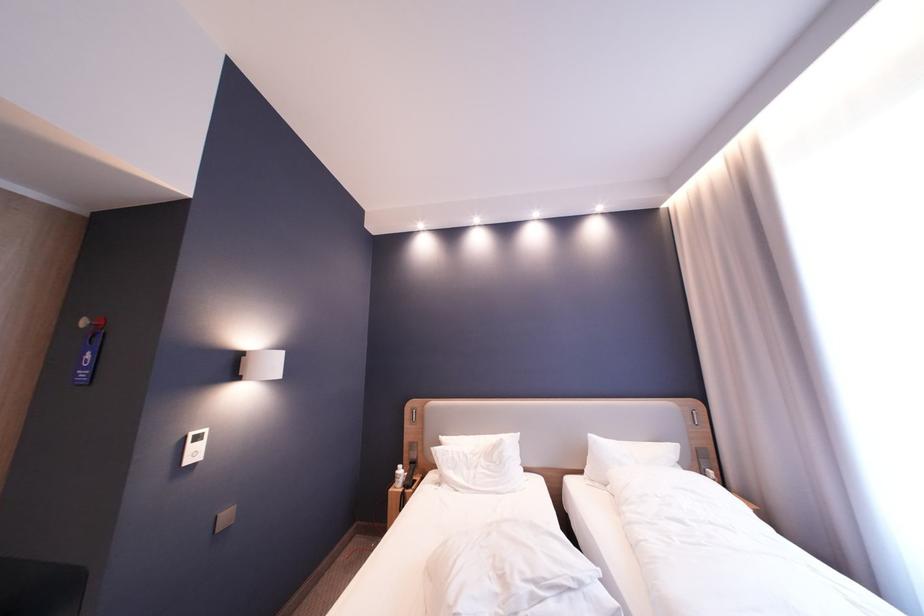
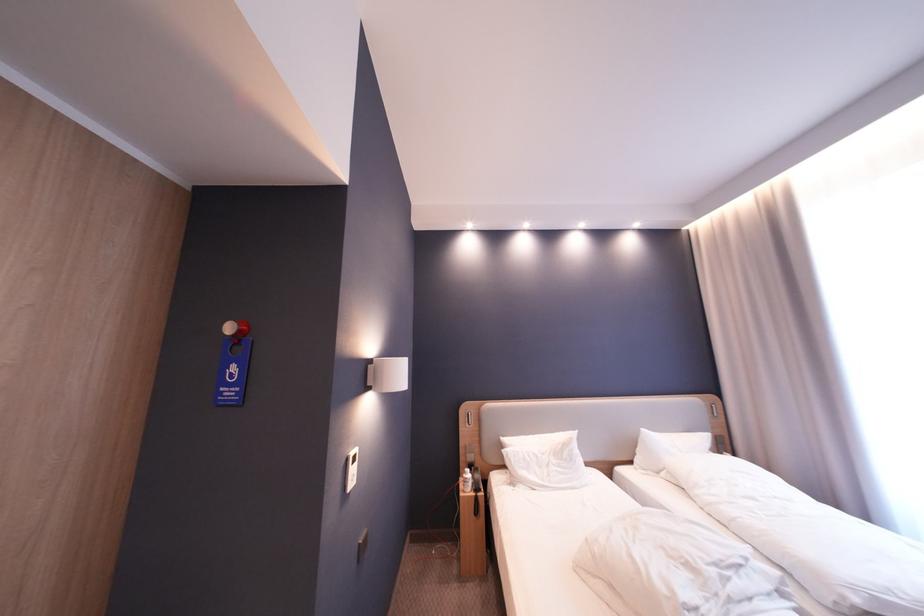
Locate, in the second image, the point that corresponds to the point at 94,323 in the first image.

(240, 329)